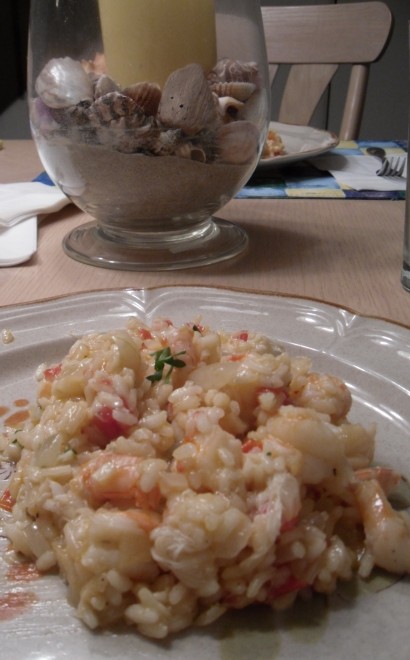
Identify the location of tabletop. (21, 160), (350, 248).